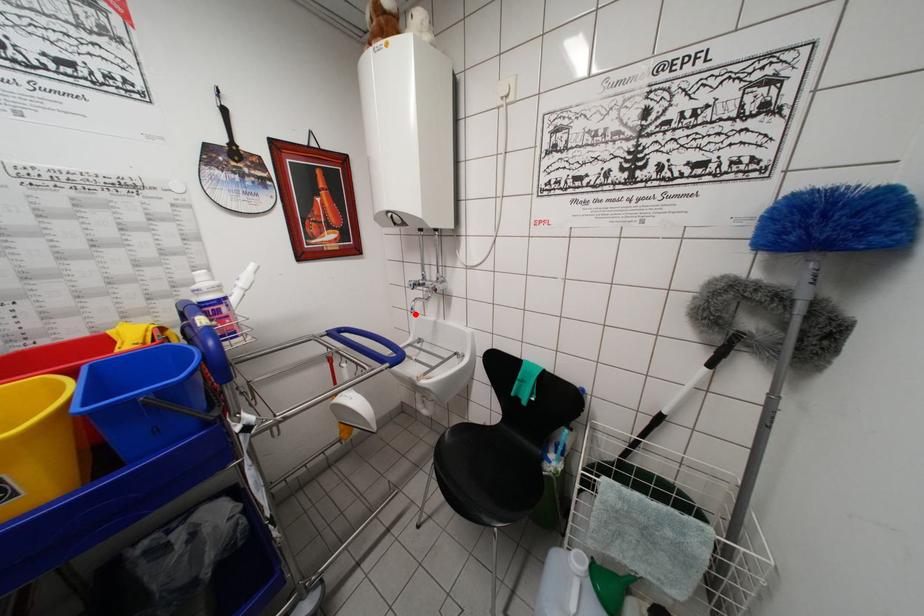
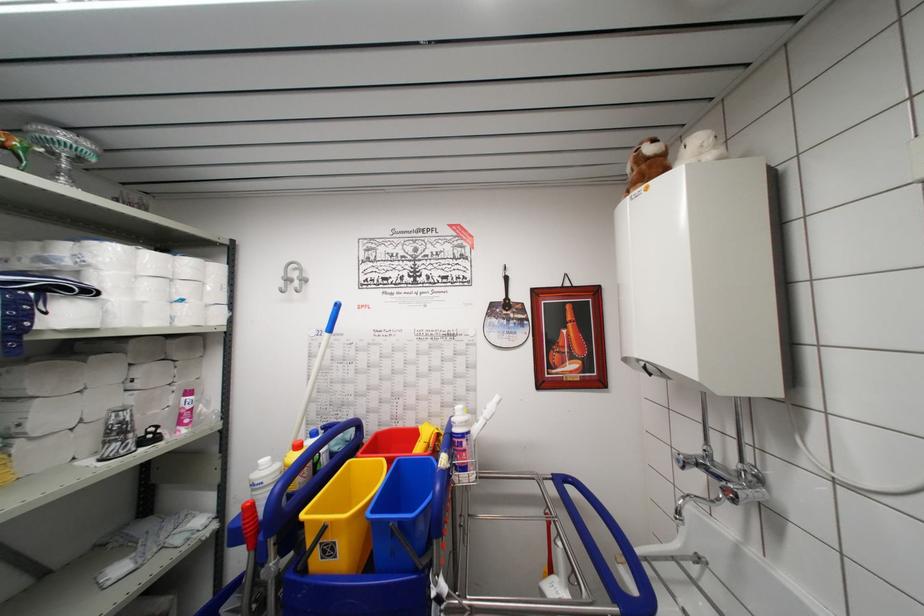
In the second image, find the point that corresponds to the highlighted location in the first image.

(681, 517)